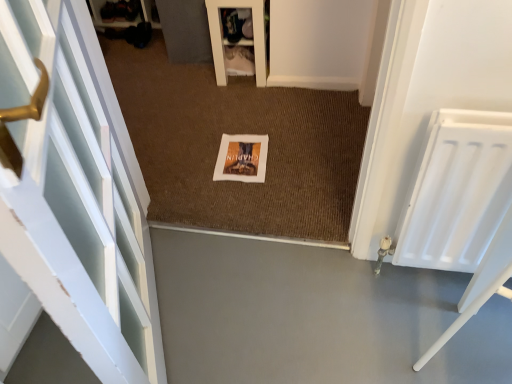
This screenshot has width=512, height=384. I want to click on free spot below white matte radiator at right (from a real-world perspective), so click(x=424, y=278).